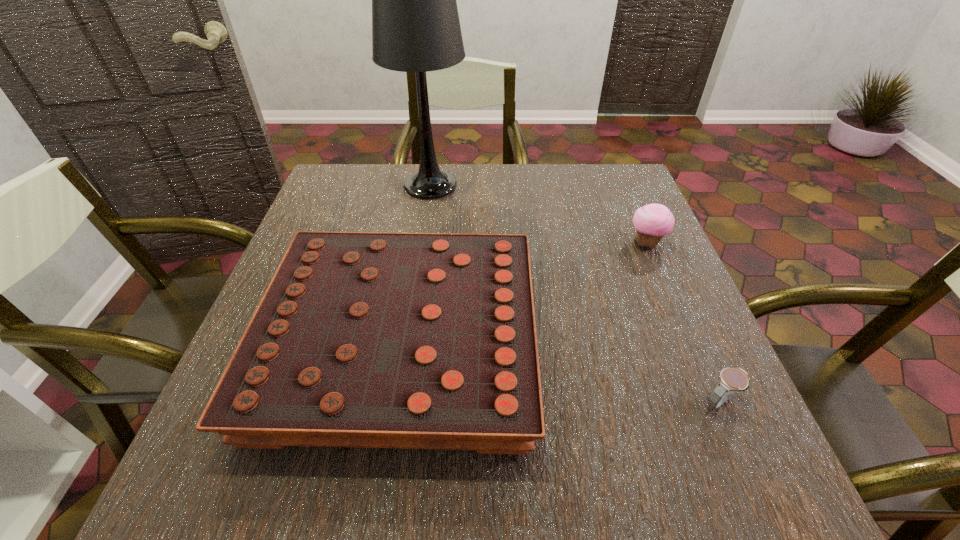
Locate an element on the screen. The image size is (960, 540). the third closest object to the third nearest object is located at coordinates (415, 23).

At what (x,y) coordinates should I click in order to perform the action: click on free space that satisfies the following two spatial constraints: 1. on the front side of the gameboard; 2. on the left side of the watch. Please return your answer as a coordinate pair (x, y). Looking at the image, I should click on (392, 402).

You are a GUI agent. You are given a task and a screenshot of the screen. Output one action in this format:
    pyautogui.click(x=<x>, y=<y>)
    Task: Click on the vacant area that satisfies the following two spatial constraints: 1. on the front side of the second farthest object; 2. on the left side of the table lamp
    The image size is (960, 540).
    Given the screenshot: What is the action you would take?
    pyautogui.click(x=421, y=243)

I want to click on free space that satisfies the following two spatial constraints: 1. on the front side of the shortest object; 2. on the left side of the gameboard, so click(392, 402).